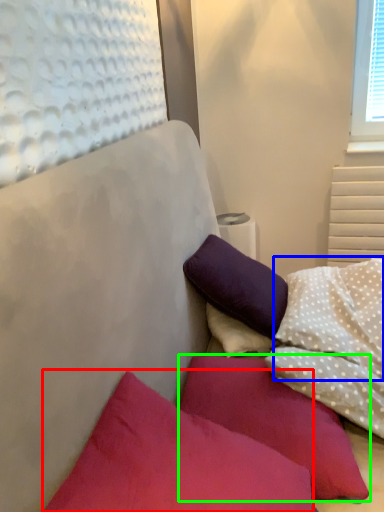
Question: Which object is positioned closest to pillow (highlighted by a red box)? Select from pillow (highlighted by a blue box) and pillow (highlighted by a green box).

Choices:
 (A) pillow
 (B) pillow

Answer: (B)